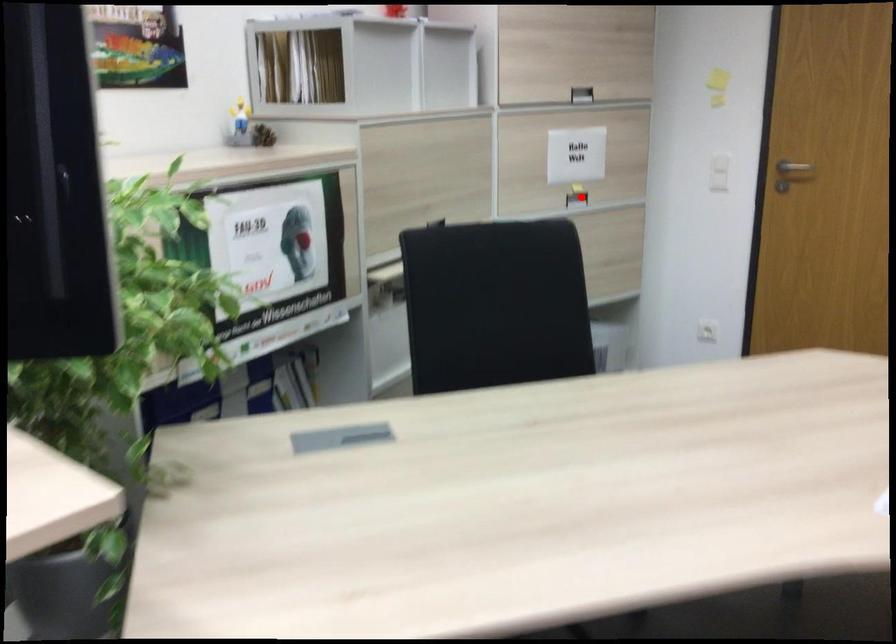
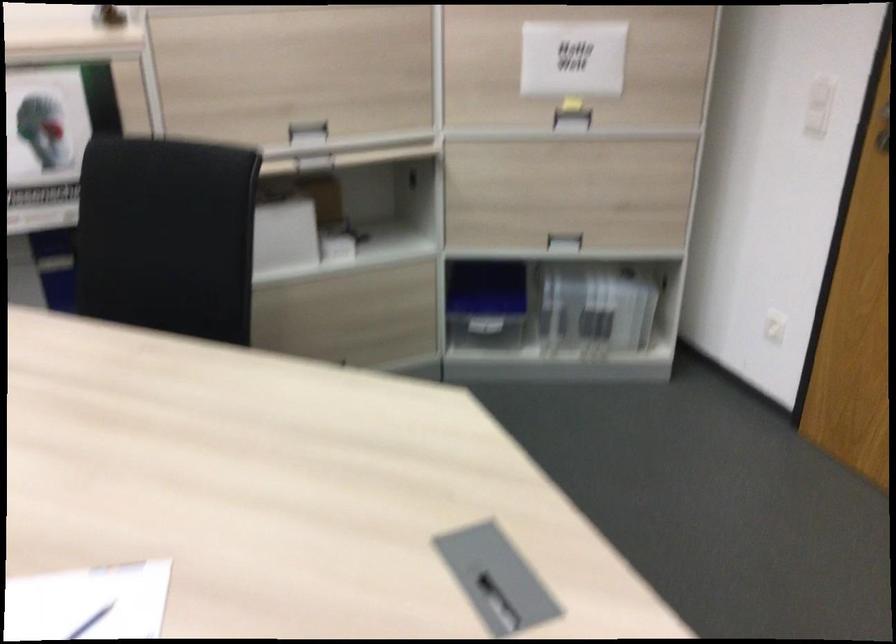
Find the pixel in the second image that matches the highlighted location in the first image.

(572, 120)